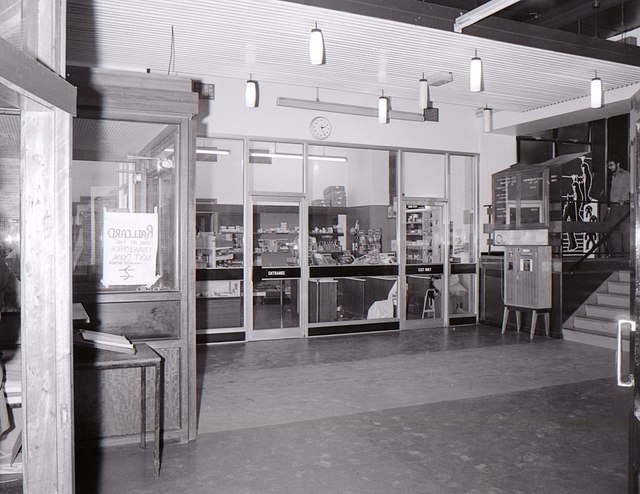
Where is `door`? This screenshot has width=640, height=494. door is located at coordinates (438, 236), (262, 237).